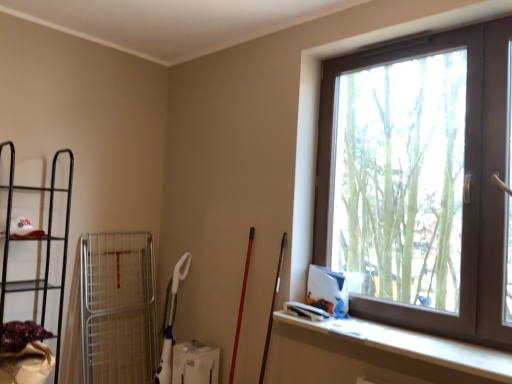
Question: Does brown plastic window at upper right have a lesser height compared to black metal shelf at left?

Choices:
 (A) no
 (B) yes

Answer: (A)

Question: Is brown plastic window at upper right to the left of black metal shelf at left from the viewer's perspective?

Choices:
 (A) yes
 (B) no

Answer: (B)

Question: Is brown plastic window at upper right further to camera compared to black metal shelf at left?

Choices:
 (A) no
 (B) yes

Answer: (A)

Question: Is brown plastic window at upper right at the right side of black metal shelf at left?

Choices:
 (A) yes
 (B) no

Answer: (A)

Question: Is brown plastic window at upper right facing towards black metal shelf at left?

Choices:
 (A) no
 (B) yes

Answer: (A)

Question: Can you confirm if brown plastic window at upper right is smaller than black metal shelf at left?

Choices:
 (A) no
 (B) yes

Answer: (A)

Question: Is black metal shelf at left facing towards brown plastic window at upper right?

Choices:
 (A) yes
 (B) no

Answer: (B)

Question: Is black metal shelf at left further to camera compared to brown plastic window at upper right?

Choices:
 (A) no
 (B) yes

Answer: (B)

Question: Is black metal shelf at left bigger than brown plastic window at upper right?

Choices:
 (A) no
 (B) yes

Answer: (A)

Question: Is black metal shelf at left looking in the opposite direction of brown plastic window at upper right?

Choices:
 (A) no
 (B) yes

Answer: (A)

Question: From a real-world perspective, does black metal shelf at left stand above brown plastic window at upper right?

Choices:
 (A) yes
 (B) no

Answer: (B)

Question: Considering the relative sizes of black metal shelf at left and brown plastic window at upper right in the image provided, is black metal shelf at left taller than brown plastic window at upper right?

Choices:
 (A) yes
 (B) no

Answer: (B)

Question: Is white matte ledge at lower right taller than black metal shelf at left?

Choices:
 (A) no
 (B) yes

Answer: (A)